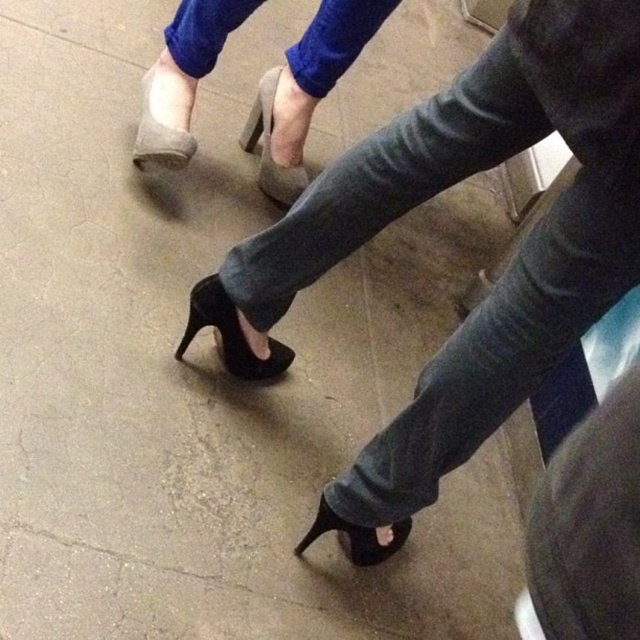
Is black denim jeans at center wider than suede high-heeled shoes at upper center?

Yes, black denim jeans at center is wider than suede high-heeled shoes at upper center.

Which of these two, black denim jeans at center or suede high-heeled shoes at upper center, stands shorter?

With less height is suede high-heeled shoes at upper center.

You are a GUI agent. You are given a task and a screenshot of the screen. Output one action in this format:
    pyautogui.click(x=<x>, y=<y>)
    Task: Click on the black denim jeans at center
    The image size is (640, 640).
    Given the screenshot: What is the action you would take?
    pyautogui.click(x=515, y=256)

I want to click on black denim jeans at center, so click(x=515, y=256).

Between black leather high-heeled shoe at center and black leather high-heeled shoe at lower center, which one has less height?

With less height is black leather high-heeled shoe at lower center.

Measure the distance between black leather high-heeled shoe at center and camera.

The distance of black leather high-heeled shoe at center from camera is 4.13 feet.

The height and width of the screenshot is (640, 640). I want to click on black leather high-heeled shoe at center, so click(x=230, y=333).

Who is positioned more to the right, suede high-heeled shoes at upper center or suede-like beige high-heeled shoe at center?

Positioned to the right is suede high-heeled shoes at upper center.

Is point (184, 70) closer to viewer compared to point (272, 180)?

Yes.

You are a GUI agent. You are given a task and a screenshot of the screen. Output one action in this format:
    pyautogui.click(x=<x>, y=<y>)
    Task: Click on the suede high-heeled shoes at upper center
    Image resolution: width=640 pixels, height=640 pixels.
    Given the screenshot: What is the action you would take?
    pyautogui.click(x=305, y=90)